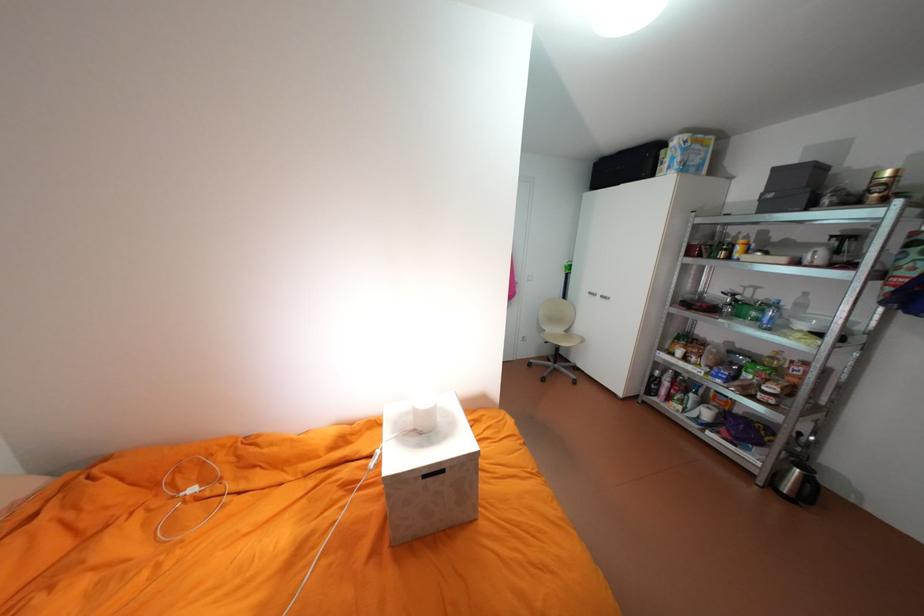
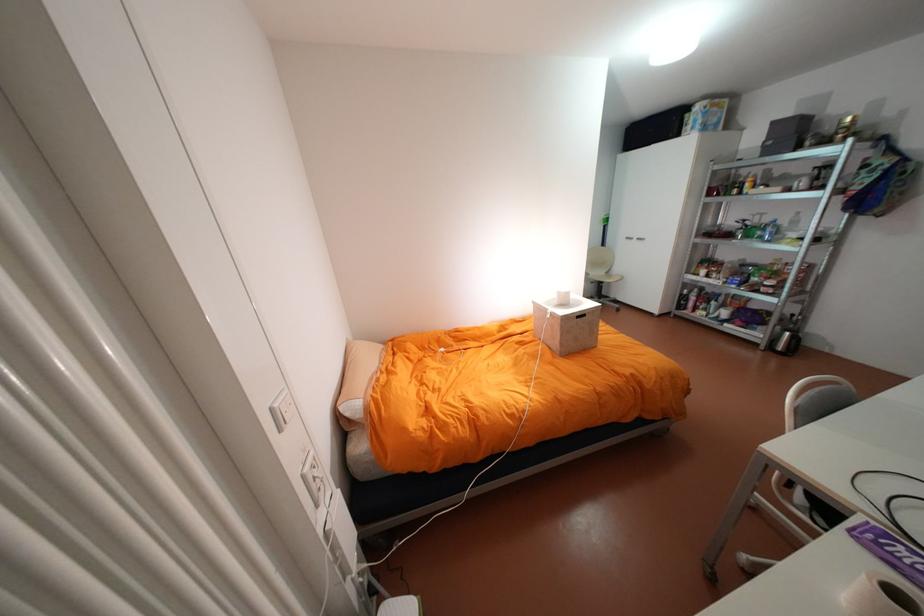
Which direction would the cameraman need to move to produce the second image?

The cameraman moved toward left, backward.